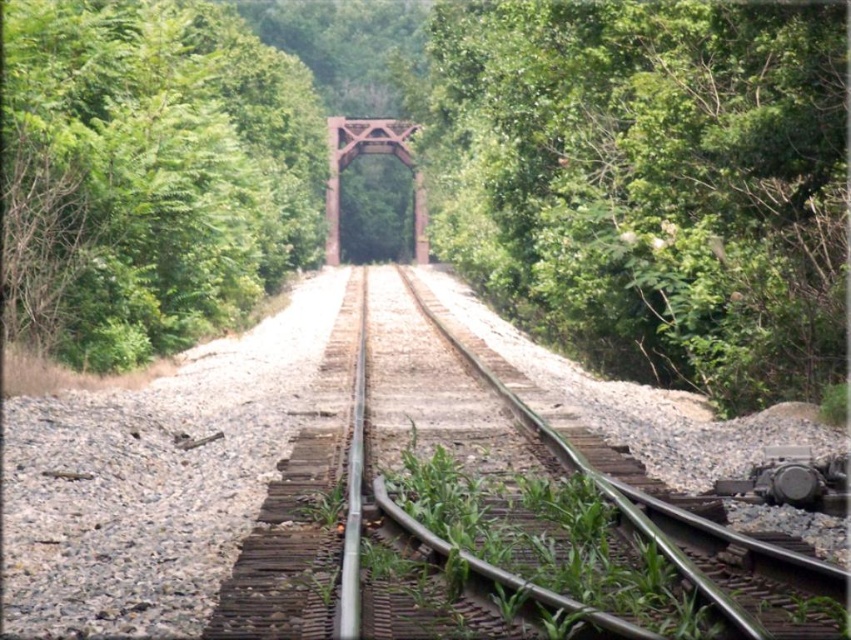
Question: Can you confirm if green leafy tree at center is positioned to the left of rusty metal train bridge at center?

Choices:
 (A) yes
 (B) no

Answer: (B)

Question: Observing the image, what is the correct spatial positioning of green leafy tree at center in reference to rusty metal train bridge at center?

Choices:
 (A) left
 (B) right

Answer: (B)

Question: Which point is farther to the camera?

Choices:
 (A) rusty metal train bridge at center
 (B) green leafy tree at center
 (C) metallic train track at center
 (D) green leafy tree at left

Answer: (A)

Question: Does green leafy tree at center come in front of rusty metal train bridge at center?

Choices:
 (A) yes
 (B) no

Answer: (A)

Question: Among these objects, which one is nearest to the camera?

Choices:
 (A) metallic train track at center
 (B) green leafy tree at left
 (C) green leafy tree at center

Answer: (A)

Question: Which object is positioned farthest from the rusty metal train bridge at center?

Choices:
 (A) metallic train track at center
 (B) green leafy tree at left
 (C) green leafy tree at center

Answer: (A)